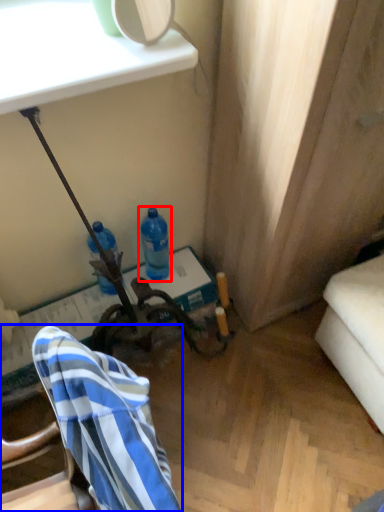
Question: Which object is further to the camera taking this photo, bottle (highlighted by a red box) or chair (highlighted by a blue box)?

Choices:
 (A) bottle
 (B) chair

Answer: (A)